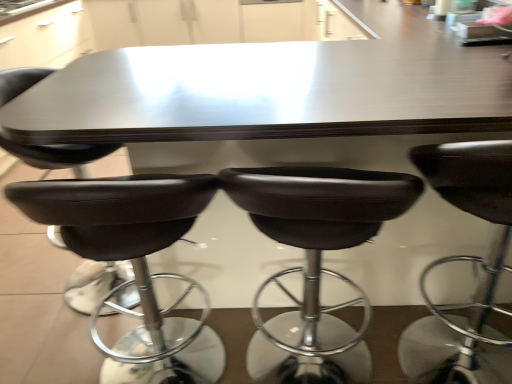
Question: From the image's perspective, does black leather chair at lower left, the second chair when ordered from left to right, appear higher than black leather stool at center, the fifth chair when ordered from left to right?

Choices:
 (A) no
 (B) yes

Answer: (B)

Question: Can you confirm if black leather chair at lower left, the second chair when ordered from left to right, is positioned to the right of black leather stool at center, placed as the first chair when sorted from right to left?

Choices:
 (A) yes
 (B) no

Answer: (B)

Question: Is black leather chair at lower left, marked as the fourth chair in a right-to-left arrangement, wider than black leather stool at center, the fifth chair when ordered from left to right?

Choices:
 (A) no
 (B) yes

Answer: (A)

Question: Considering the relative sizes of black leather chair at lower left, marked as the fourth chair in a right-to-left arrangement, and black leather stool at center, placed as the first chair when sorted from right to left, in the image provided, is black leather chair at lower left, marked as the fourth chair in a right-to-left arrangement, bigger than black leather stool at center, placed as the first chair when sorted from right to left,?

Choices:
 (A) no
 (B) yes

Answer: (A)

Question: Considering the relative positions of black leather chair at lower left, marked as the fourth chair in a right-to-left arrangement, and black leather stool at center, the fifth chair when ordered from left to right, in the image provided, is black leather chair at lower left, marked as the fourth chair in a right-to-left arrangement, to the left of black leather stool at center, the fifth chair when ordered from left to right, from the viewer's perspective?

Choices:
 (A) yes
 (B) no

Answer: (A)

Question: From the image's perspective, is black leather chair at lower left, the second chair when ordered from left to right, positioned above or below black leather stool at center, which is counted as the fourth chair, starting from the left?

Choices:
 (A) below
 (B) above

Answer: (B)

Question: From a real-world perspective, is black leather chair at lower left, marked as the fourth chair in a right-to-left arrangement, physically located above or below black leather stool at center, which is counted as the fourth chair, starting from the left?

Choices:
 (A) below
 (B) above

Answer: (B)

Question: Is black leather chair at lower left, marked as the fourth chair in a right-to-left arrangement, in front of or behind black leather stool at center, marked as the 2th chair in a right-to-left arrangement, in the image?

Choices:
 (A) behind
 (B) front

Answer: (A)

Question: Is point (116, 294) positioned closer to the camera than point (264, 218)?

Choices:
 (A) farther
 (B) closer

Answer: (A)

Question: From the image's perspective, is black leather stool at center, which is the third chair from right to left, above or below black leather stool at center, placed as the first chair when sorted from right to left?

Choices:
 (A) below
 (B) above

Answer: (A)

Question: From a real-world perspective, is black leather stool at center, the 3th chair positioned from the left, physically located above or below black leather stool at center, the fifth chair when ordered from left to right?

Choices:
 (A) below
 (B) above

Answer: (A)

Question: Would you say black leather stool at center, which is the third chair from right to left, is to the left or to the right of black leather stool at center, the fifth chair when ordered from left to right, in the picture?

Choices:
 (A) left
 (B) right

Answer: (A)

Question: Considering the positions of point (148, 276) and point (498, 380), is point (148, 276) closer or farther from the camera than point (498, 380)?

Choices:
 (A) farther
 (B) closer

Answer: (B)

Question: Based on their positions, is black leather stool at center, which is the third chair from right to left, located to the left or right of black leather stool at center, marked as the 2th chair in a right-to-left arrangement?

Choices:
 (A) right
 (B) left

Answer: (B)

Question: From the image's perspective, is black leather stool at center, the 3th chair positioned from the left, located above or below black leather stool at center, which is counted as the fourth chair, starting from the left?

Choices:
 (A) below
 (B) above

Answer: (A)